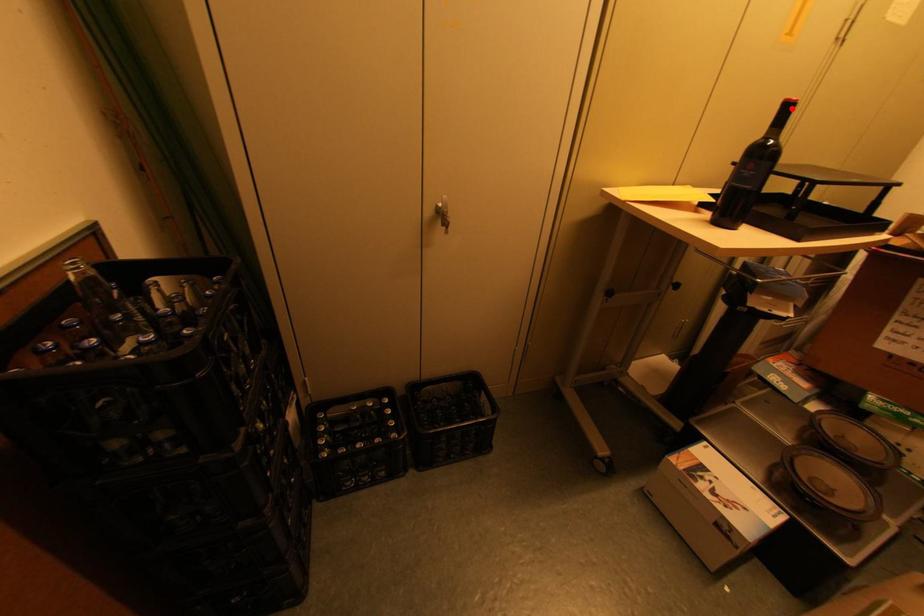
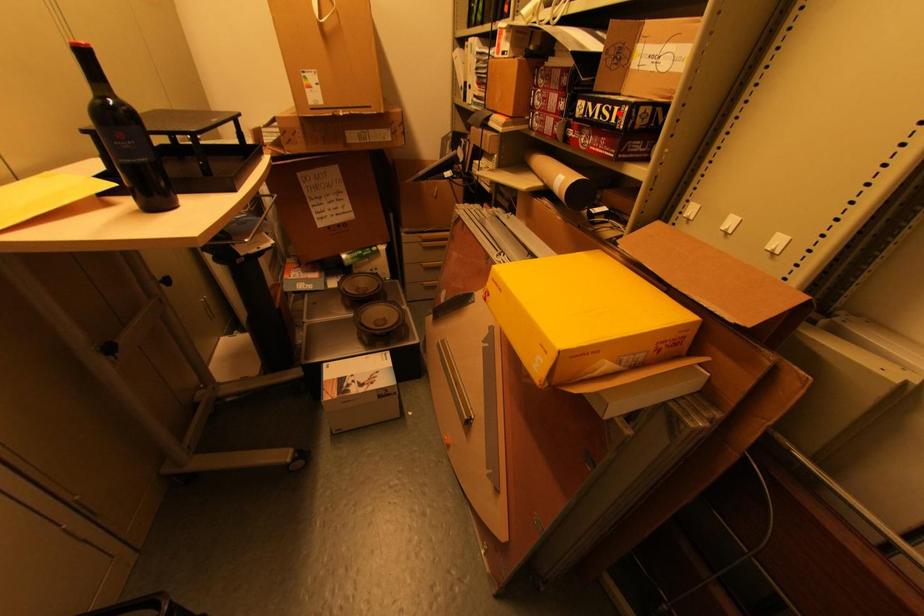
I am providing you with two images of the same scene from different viewpoints. A red point is marked on the first image and another point is marked on the second image. Is the marked point in image1 the same physical position as the marked point in image2?

No